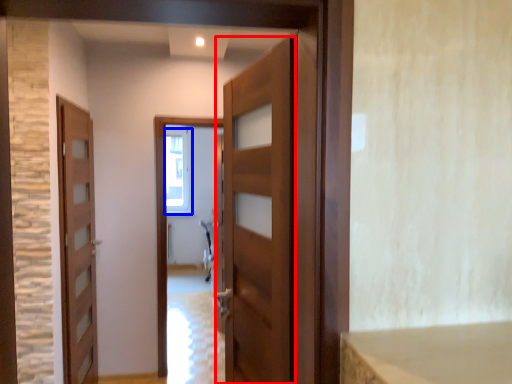
Question: Which point is closer to the camera, door (highlighted by a red box) or window (highlighted by a blue box)?

Choices:
 (A) door
 (B) window

Answer: (A)